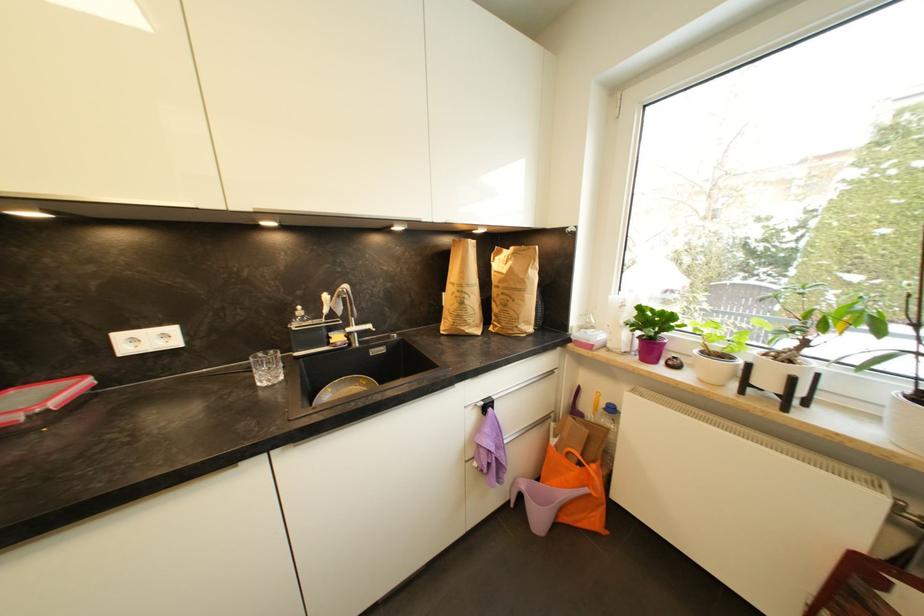
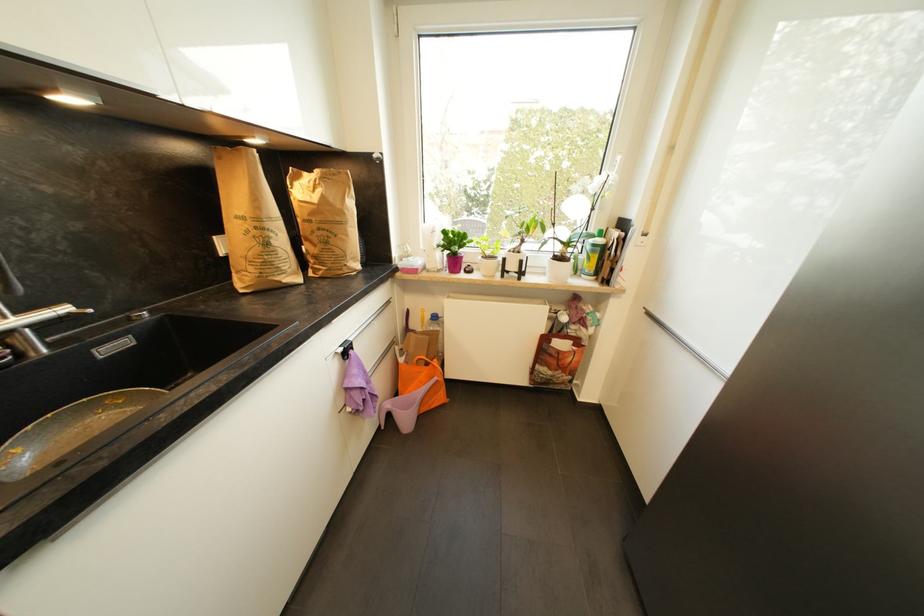
The point at (772, 384) is marked in the first image. Where is the corresponding point in the second image?

(517, 268)